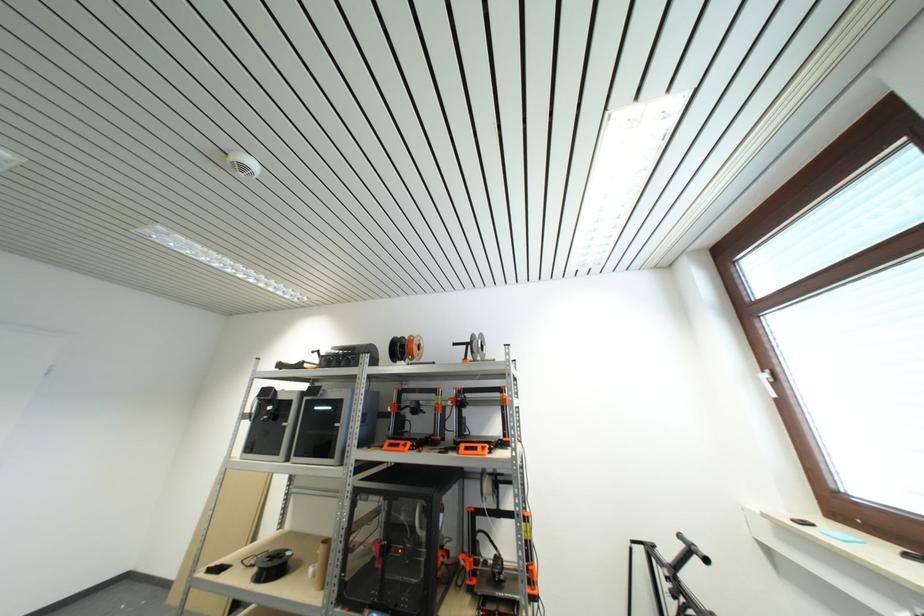
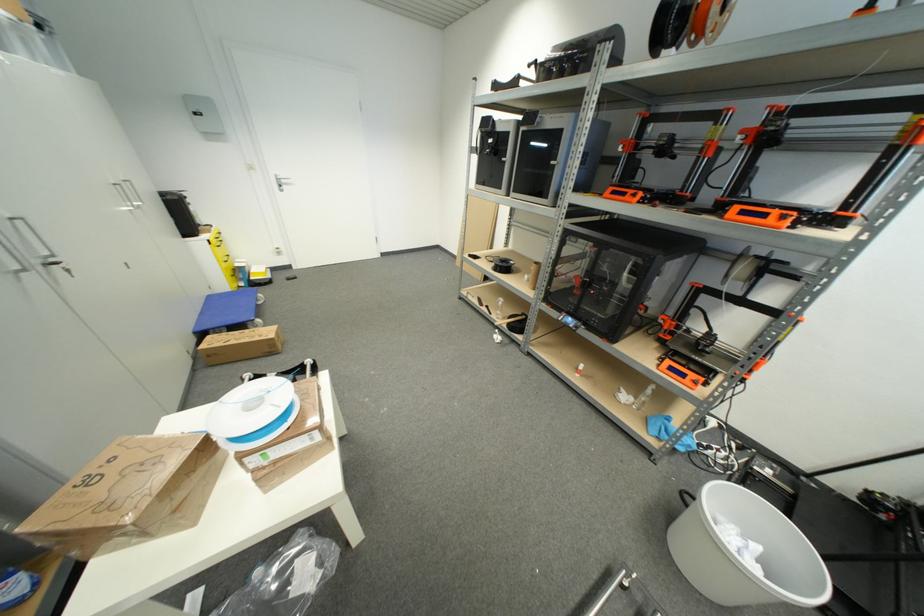
Where in the second image is the point corresponding to point 281,565 from the first image?

(508, 267)